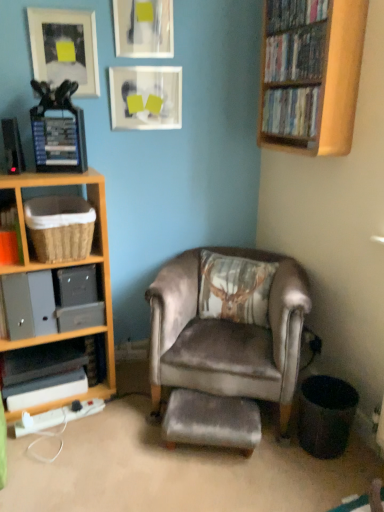
Question: Is matte black books at left, marked as the first shelf in a bottom-to-top arrangement, further to the viewer compared to velvet grey footrest at center?

Choices:
 (A) no
 (B) yes

Answer: (B)

Question: Is matte black books at left, the 3th shelf in the top-to-bottom sequence, looking in the opposite direction of velvet grey footrest at center?

Choices:
 (A) no
 (B) yes

Answer: (A)

Question: Is matte black books at left, marked as the first shelf in a bottom-to-top arrangement, at the left side of velvet grey footrest at center?

Choices:
 (A) no
 (B) yes

Answer: (B)

Question: Considering the relative positions of matte black books at left, marked as the first shelf in a bottom-to-top arrangement, and velvet grey footrest at center in the image provided, is matte black books at left, marked as the first shelf in a bottom-to-top arrangement, to the right of velvet grey footrest at center from the viewer's perspective?

Choices:
 (A) no
 (B) yes

Answer: (A)

Question: Does matte black books at left, marked as the first shelf in a bottom-to-top arrangement, lie in front of velvet grey footrest at center?

Choices:
 (A) no
 (B) yes

Answer: (A)

Question: Can you confirm if matte black books at left, the 3th shelf in the top-to-bottom sequence, is thinner than velvet grey footrest at center?

Choices:
 (A) no
 (B) yes

Answer: (B)

Question: Can you confirm if velvet brown pillow at center is thinner than matte glass picture frame at upper center, which ranks as the third picture frame in left-to-right order?

Choices:
 (A) yes
 (B) no

Answer: (B)

Question: Is matte glass picture frame at upper center, which ranks as the third picture frame in left-to-right order, at the back of velvet brown pillow at center?

Choices:
 (A) yes
 (B) no

Answer: (B)

Question: Is velvet brown pillow at center to the left of matte glass picture frame at upper center, the first picture frame when ordered from right to left, from the viewer's perspective?

Choices:
 (A) no
 (B) yes

Answer: (A)

Question: From a real-world perspective, does velvet brown pillow at center sit lower than matte glass picture frame at upper center, which ranks as the third picture frame in left-to-right order?

Choices:
 (A) yes
 (B) no

Answer: (A)

Question: Can you see velvet brown pillow at center touching matte glass picture frame at upper center, the first picture frame when ordered from right to left?

Choices:
 (A) yes
 (B) no

Answer: (B)

Question: Is velvet brown pillow at center not inside matte glass picture frame at upper center, which ranks as the third picture frame in left-to-right order?

Choices:
 (A) yes
 (B) no

Answer: (A)

Question: Is woven brown basket at left, the first shelf in the top-to-bottom sequence, bigger than matte plastic dvds at upper right, the 1th book positioned from the bottom?

Choices:
 (A) no
 (B) yes

Answer: (B)